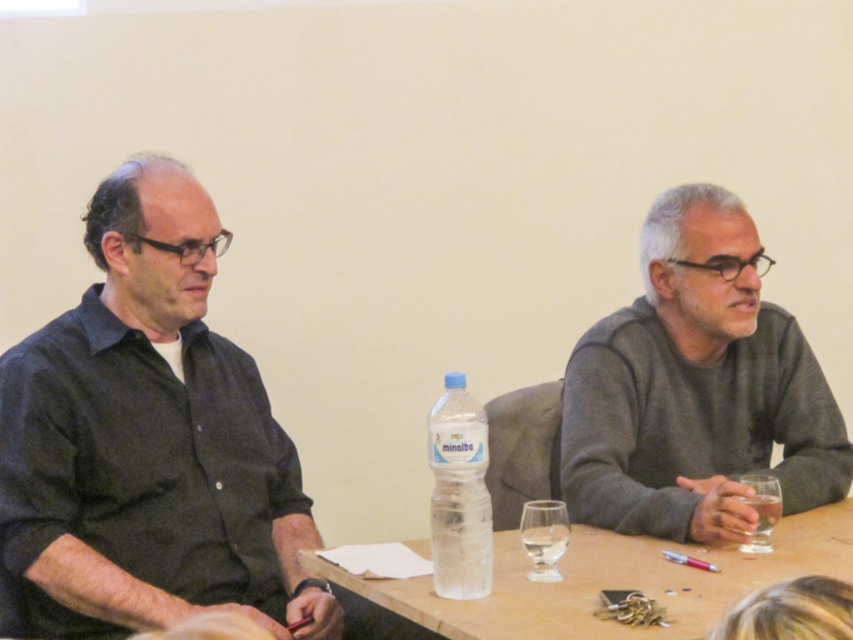
Question: Which is farther from the clear plastic table at center?

Choices:
 (A) gray sweater at right
 (B) clear plastic bottle at center

Answer: (A)

Question: Where is black matte shirt at left located in relation to gray sweater at right in the image?

Choices:
 (A) below
 (B) above

Answer: (A)

Question: Among these points, which one is farthest from the camera?

Choices:
 (A) (474, 484)
 (B) (683, 390)

Answer: (B)

Question: Which point is farther to the camera?

Choices:
 (A) (785, 547)
 (B) (625, 403)

Answer: (B)

Question: Can you confirm if gray sweater at right is positioned to the left of clear plastic bottle at center?

Choices:
 (A) yes
 (B) no

Answer: (B)

Question: Considering the relative positions of black matte shirt at left and gray sweater at right in the image provided, where is black matte shirt at left located with respect to gray sweater at right?

Choices:
 (A) above
 (B) below

Answer: (B)